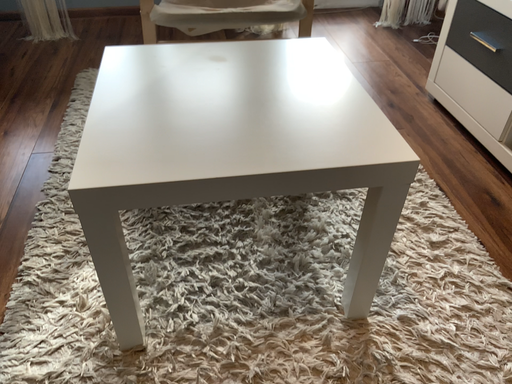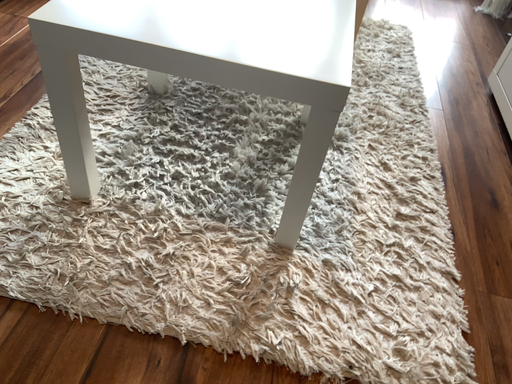
Question: Which way did the camera rotate in the video?

Choices:
 (A) rotated right
 (B) rotated left

Answer: (B)